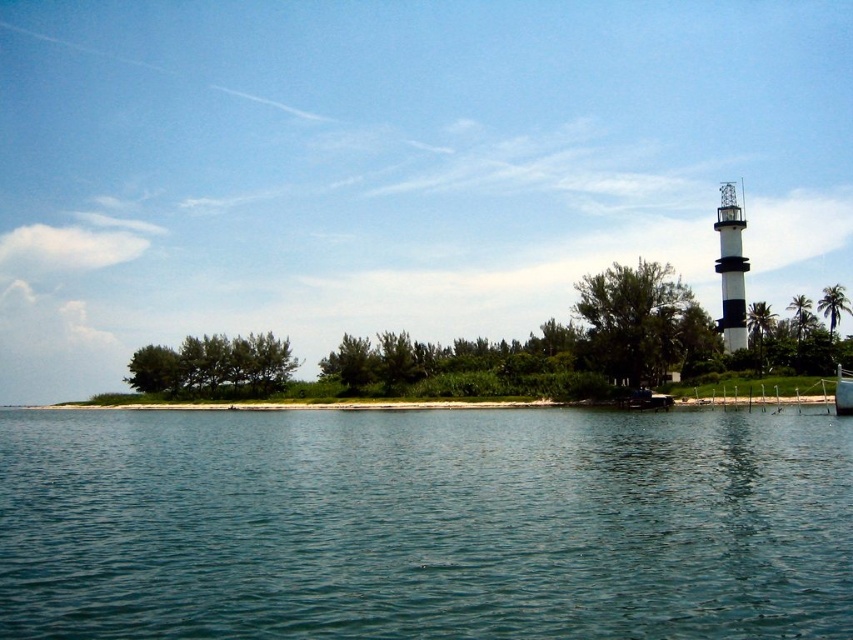
You are a bird flying over the coastal scene. You see the black and white striped tower at right and the green leafy palm tree at upper right. Which object is closer to your current position?

The black and white striped tower at right is closer to your current position because the green leafy palm tree at upper right is behind it.

You are a photographer planning to capture the black and white striped tower at right and the green leafy palm tree at upper right in the same frame. Based on their sizes, which object should you focus on to ensure both are visible without cropping?

Since the black and white striped tower at right is smaller than the green leafy palm tree at upper right, you should focus on the black and white striped tower at right to ensure both are visible without cropping.

You are a bird flying over the coastal scene and want to land on the clear blue water at center. According to the coordinates provided, is the point point (424, 524) a suitable spot for landing?

Yes, the point (424, 524) is on the clear blue water at center, so it is a suitable spot for landing.